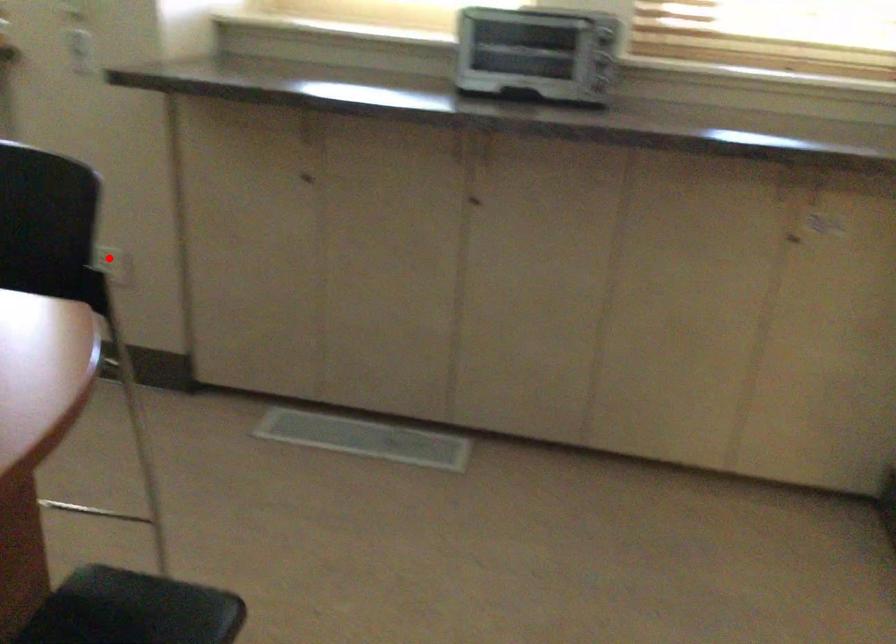
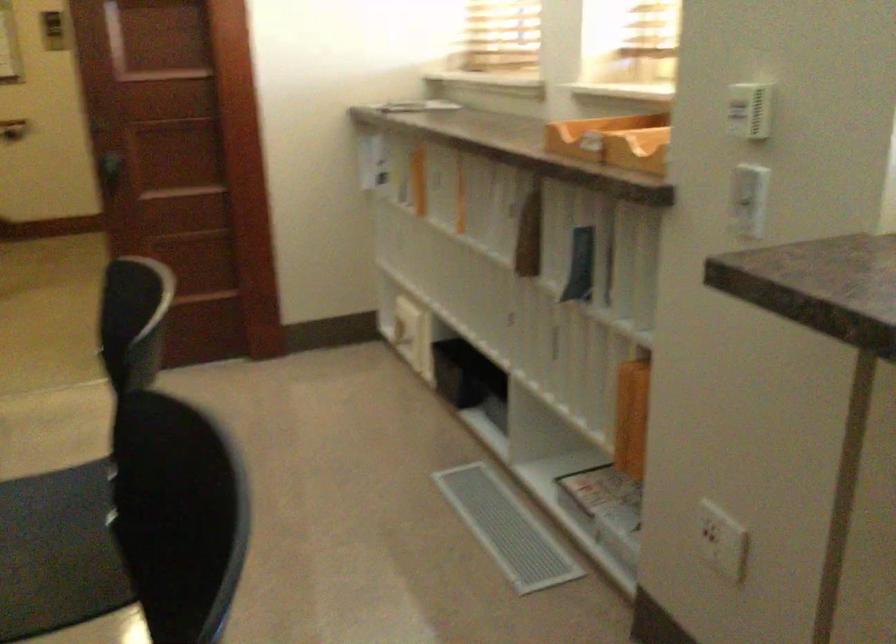
Question: A red point is marked in image1. In image2, is the corresponding 3D point closer to the camera or farther? Reply with the corresponding letter.

Choices:
 (A) The corresponding 3D point is closer.
 (B) The corresponding 3D point is farther.

Answer: (A)